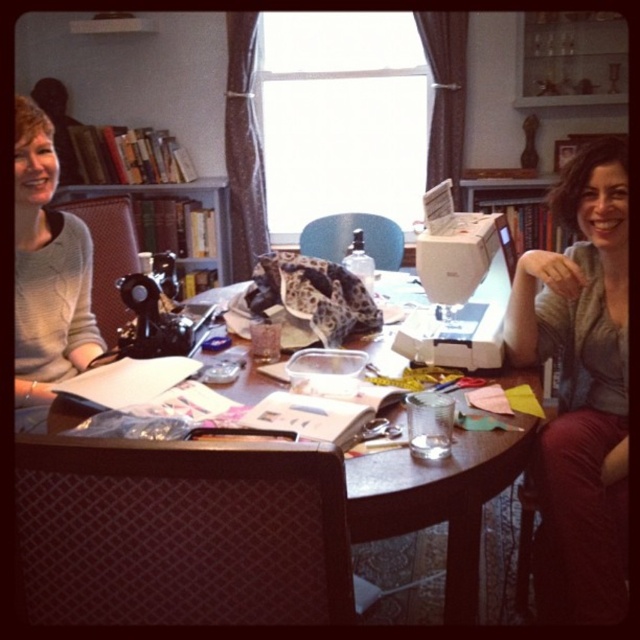
Question: Based on their relative distances, which object is nearer to the light gray sweater at left?

Choices:
 (A) wooden bookshelf at upper left
 (B) wooden table at center

Answer: (B)

Question: Which point is closer to the camera?

Choices:
 (A) (618, 506)
 (B) (513, 534)
 (C) (144, 189)
 (D) (32, 358)

Answer: (A)

Question: Considering the relative positions of wooden table at center and wooden bookshelf at upper left in the image provided, where is wooden table at center located with respect to wooden bookshelf at upper left?

Choices:
 (A) below
 (B) above

Answer: (A)

Question: Does wooden table at center have a smaller size compared to wooden bookshelf at upper left?

Choices:
 (A) no
 (B) yes

Answer: (B)

Question: Can you confirm if matte gray sweater at right is positioned below wooden table at center?

Choices:
 (A) yes
 (B) no

Answer: (B)

Question: Among these objects, which one is nearest to the camera?

Choices:
 (A) matte gray sweater at right
 (B) light gray sweater at left
 (C) wooden table at center
 (D) wooden bookshelf at upper left

Answer: (A)